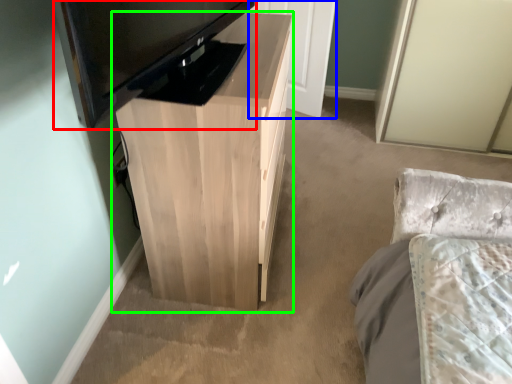
Question: Which is farther away from television (highlighted by a red box)? door (highlighted by a blue box) or table (highlighted by a green box)?

Choices:
 (A) door
 (B) table

Answer: (A)